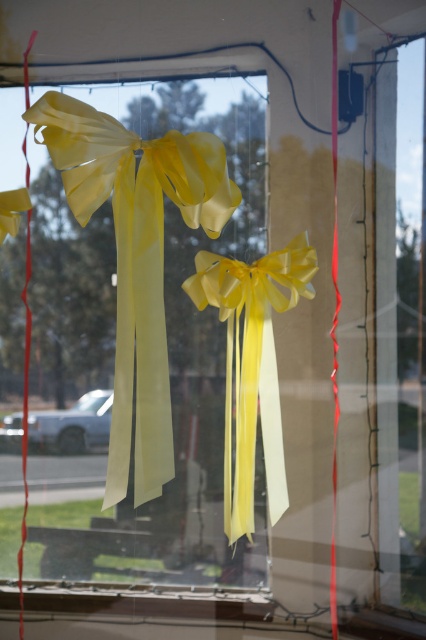
Is translucent yellow ribbon at center further to camera compared to yellow satin ribbon at center?

That is False.

Does point (135, 490) come behind point (273, 520)?

No, (135, 490) is closer to viewer.

Which is in front, point (138, 388) or point (255, 276)?

Point (138, 388)

Identify the location of translucent yellow ribbon at center. The image size is (426, 640). [x=137, y=257].

Can you confirm if translucent yellow ribbon at center is wider than transparent plastic ribbon at right?

Indeed, translucent yellow ribbon at center has a greater width compared to transparent plastic ribbon at right.

Between translucent yellow ribbon at center and transparent plastic ribbon at right, which one is positioned higher?

translucent yellow ribbon at center is higher up.

The width and height of the screenshot is (426, 640). What are the coordinates of `translucent yellow ribbon at center` in the screenshot? It's located at (137, 257).

Where is `translucent yellow ribbon at center`? translucent yellow ribbon at center is located at coordinates (137, 257).

Is transparent plastic ribbon at right to the right of yellow satin ribbon at center from the viewer's perspective?

Indeed, transparent plastic ribbon at right is positioned on the right side of yellow satin ribbon at center.

Is transparent plastic ribbon at right in front of yellow satin ribbon at center?

No, it is not.

The width and height of the screenshot is (426, 640). What do you see at coordinates (397, 362) in the screenshot? I see `transparent plastic ribbon at right` at bounding box center [397, 362].

In order to click on transparent plastic ribbon at right in this screenshot , I will do `click(397, 362)`.